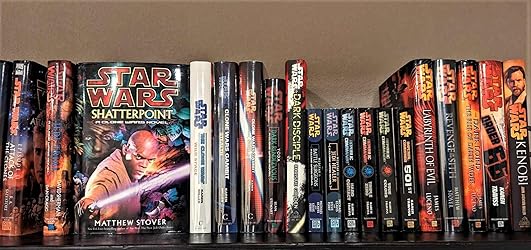
Identify the location of short books. The image size is (531, 250). (404, 129), (380, 130), (370, 133), (350, 134), (330, 137), (313, 161).